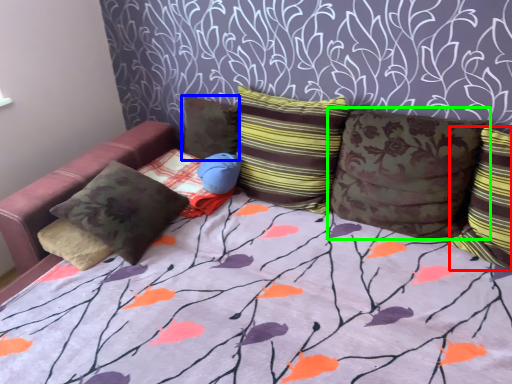
Question: Based on their relative distances, which object is farther from pillow (highlighted by a red box)? Choose from pillow (highlighted by a blue box) and pillow (highlighted by a green box).

Choices:
 (A) pillow
 (B) pillow

Answer: (A)